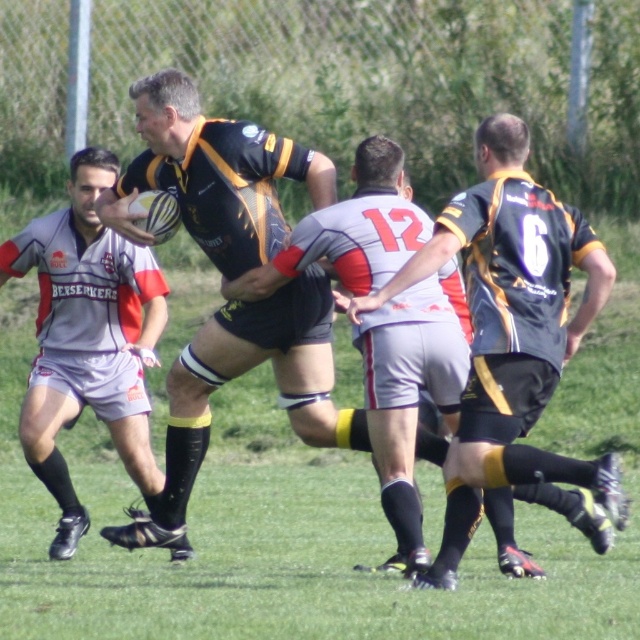
Which is in front, point (112, 200) or point (56, 417)?

Point (112, 200)

Between matte black rugby ball at center and matte black rugby ball at left, which one has less height?

matte black rugby ball at left is shorter.

In order to click on matte black rugby ball at center in this screenshot , I will do [212, 176].

I want to click on matte black rugby ball at center, so click(x=212, y=176).

Between point (605, 298) and point (93, 244), which one is positioned in front?

Point (605, 298) is more forward.

Can you confirm if matte black jersey at center is wider than matte black rugby ball at left?

Indeed, matte black jersey at center has a greater width compared to matte black rugby ball at left.

Is point (452, 240) behind point (138, 278)?

That is False.

This screenshot has height=640, width=640. I want to click on matte black jersey at center, so click(x=509, y=330).

Does matte black rugby ball at center have a greater width compared to matte black jersey at center?

Indeed, matte black rugby ball at center has a greater width compared to matte black jersey at center.

Which is below, matte black rugby ball at center or matte black jersey at center?

Positioned lower is matte black jersey at center.

At what (x,y) coordinates should I click in order to perform the action: click on matte black rugby ball at center. Please return your answer as a coordinate pair (x, y). The width and height of the screenshot is (640, 640). Looking at the image, I should click on (212, 176).